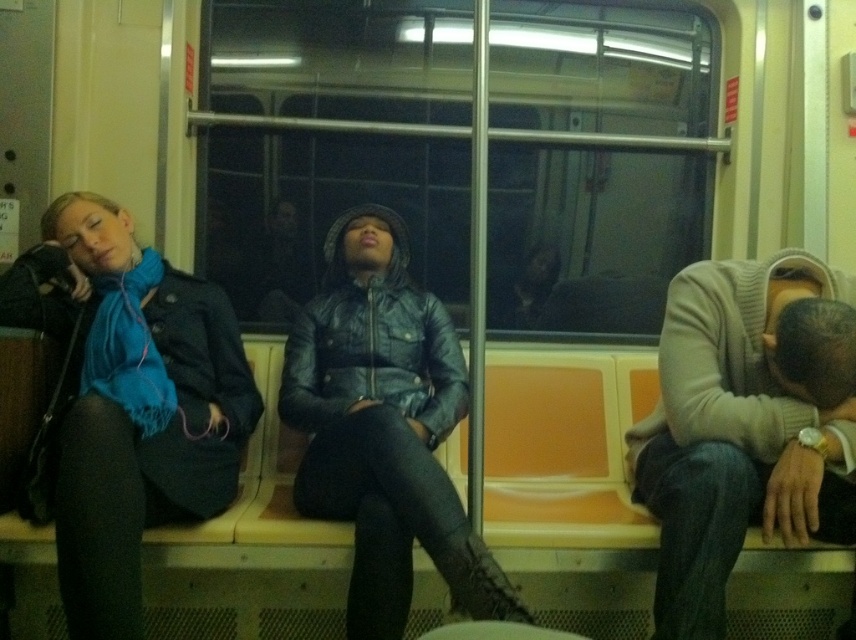
Does light gray sweater at right appear under matte black coat at left?

Correct, light gray sweater at right is located below matte black coat at left.

Is point (733, 560) less distant than point (110, 570)?

No, it is not.

This screenshot has width=856, height=640. In order to click on light gray sweater at right in this screenshot , I will do `click(745, 424)`.

Can you confirm if light gray sweater at right is wider than leather jacket at center?

No, light gray sweater at right is not wider than leather jacket at center.

Is light gray sweater at right to the left of leather jacket at center from the viewer's perspective?

Incorrect, light gray sweater at right is not on the left side of leather jacket at center.

This screenshot has height=640, width=856. Describe the element at coordinates (745, 424) in the screenshot. I see `light gray sweater at right` at that location.

Locate an element on the screen. This screenshot has width=856, height=640. light gray sweater at right is located at coordinates (745, 424).

Who is taller, matte black coat at left or leather jacket at center?

Standing taller between the two is leather jacket at center.

Who is higher up, matte black coat at left or leather jacket at center?

Positioned higher is matte black coat at left.

Who is more forward, (165, 419) or (497, 602)?

Point (497, 602) is more forward.

In order to click on matte black coat at left in this screenshot , I will do `click(140, 413)`.